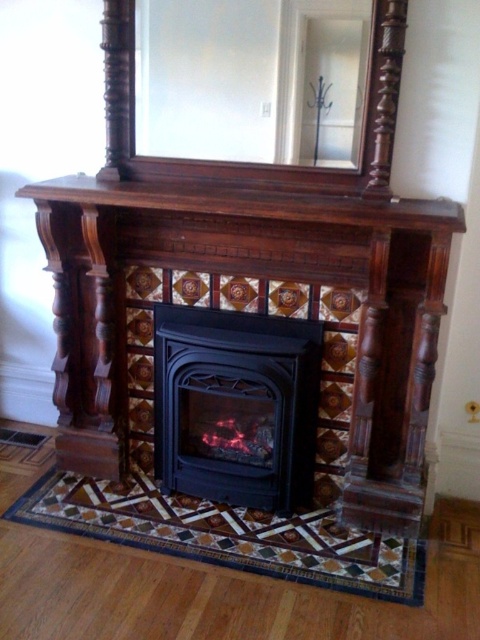
Question: Based on their relative distances, which object is nearer to the black matte fireplace at center?

Choices:
 (A) clear glass mirror at upper center
 (B) dark wood/marble fireplace mantel at upper center

Answer: (B)

Question: Which is nearer to the clear glass mirror at upper center?

Choices:
 (A) black matte fireplace at center
 (B) dark wood/marble fireplace mantel at upper center

Answer: (B)

Question: Can you confirm if clear glass mirror at upper center is thinner than black matte fireplace at center?

Choices:
 (A) no
 (B) yes

Answer: (A)

Question: Considering the relative positions of clear glass mirror at upper center and dark wood/marble fireplace mantel at upper center in the image provided, where is clear glass mirror at upper center located with respect to dark wood/marble fireplace mantel at upper center?

Choices:
 (A) above
 (B) below

Answer: (A)

Question: Which point appears farthest from the camera in this image?

Choices:
 (A) (159, 307)
 (B) (143, 4)
 (C) (160, 182)

Answer: (A)

Question: Is clear glass mirror at upper center bigger than dark wood/marble fireplace mantel at upper center?

Choices:
 (A) no
 (B) yes

Answer: (A)